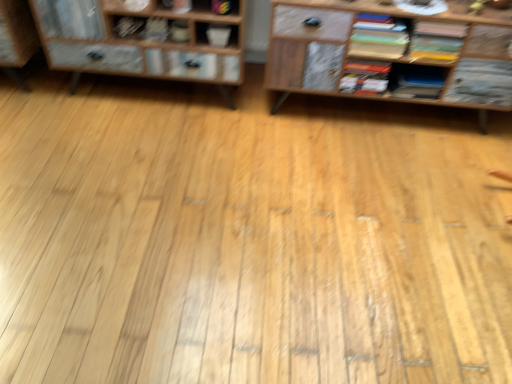
What is the approximate height of matte black book at center right, arranged as the 2th book when viewed from the right?

3.77 inches.

Identify the location of wooden cabinet at left. This screenshot has width=512, height=384. (143, 41).

You are a GUI agent. You are given a task and a screenshot of the screen. Output one action in this format:
    pyautogui.click(x=<x>, y=<y>)
    Task: Click on the multicolored paper stack at upper right, the 4th book from the left
    The height and width of the screenshot is (384, 512).
    Given the screenshot: What is the action you would take?
    pyautogui.click(x=378, y=36)

The width and height of the screenshot is (512, 384). What do you see at coordinates (129, 26) in the screenshot? I see `matte black book at upper left, which appears as the sixth book when viewed from the right` at bounding box center [129, 26].

What is the approximate height of matte yellow book at upper right, the 1th book from the right?

matte yellow book at upper right, the 1th book from the right, is 7.31 inches in height.

What are the coordinates of `matte black book at center right, arranged as the 2th book when viewed from the right` in the screenshot? It's located at (416, 81).

Considering the sizes of matte black book at center right, arranged as the 2th book when viewed from the right, and multicolored paper stack at upper right, the 4th book from the left, in the image, is matte black book at center right, arranged as the 2th book when viewed from the right, wider or thinner than multicolored paper stack at upper right, the 4th book from the left,?

In the image, matte black book at center right, arranged as the 2th book when viewed from the right, appears to be wider than multicolored paper stack at upper right, the 4th book from the left.

From a real-world perspective, is matte black book at center right, arranged as the 2th book when viewed from the right, positioned under multicolored paper stack at upper right, the 3th book from the right, based on gravity?

Yes, from a real-world perspective, matte black book at center right, arranged as the 2th book when viewed from the right, is beneath multicolored paper stack at upper right, the 3th book from the right.

How different are the orientations of matte black book at center right, arranged as the 2th book when viewed from the right, and multicolored paper stack at upper right, the 3th book from the right, in degrees?

0.000944 degrees.

Is point (412, 80) positioned in front of point (351, 52)?

No, it is behind (351, 52).

Is hardcover book at center, the 4th book in the right-to-left sequence, outside of matte black book at upper left, which appears as the sixth book when viewed from the right?

Indeed, hardcover book at center, the 4th book in the right-to-left sequence, is completely outside matte black book at upper left, which appears as the sixth book when viewed from the right.

Can you tell me how much hardcover book at center, the 4th book in the right-to-left sequence, and matte black book at upper left, placed as the first book when sorted from left to right, differ in facing direction?

hardcover book at center, the 4th book in the right-to-left sequence, and matte black book at upper left, placed as the first book when sorted from left to right, are facing 5.31 degrees away from each other.

Considering the points (374, 77) and (134, 20), which point is behind, point (374, 77) or point (134, 20)?

The point (134, 20) is farther.

From a real-world perspective, is hardcover book at center, which ranks as the 3th book in left-to-right order, on matte black book at upper left, placed as the first book when sorted from left to right?

Incorrect, from a real-world perspective, hardcover book at center, which ranks as the 3th book in left-to-right order, is lower than matte black book at upper left, placed as the first book when sorted from left to right.

Which is more to the left, matte gray book at upper center, marked as the 2th book in a left-to-right arrangement, or multicolored paper stack at upper right, the 4th book from the left?

Positioned to the left is matte gray book at upper center, marked as the 2th book in a left-to-right arrangement.

Who is shorter, matte gray book at upper center, marked as the 5th book in a right-to-left arrangement, or multicolored paper stack at upper right, the 3th book from the right?

matte gray book at upper center, marked as the 5th book in a right-to-left arrangement, is shorter.

Is multicolored paper stack at upper right, the 3th book from the right, at the back of matte gray book at upper center, marked as the 5th book in a right-to-left arrangement?

No, multicolored paper stack at upper right, the 3th book from the right, is not at the back of matte gray book at upper center, marked as the 5th book in a right-to-left arrangement.

Which book is the 2nd one when counting from the left side of the multicolored paper stack at upper right, the 4th book from the left? Please provide its 2D coordinates.

[(156, 29)]

From the image's perspective, between wooden cabinet at left and matte gray book at upper center, marked as the 5th book in a right-to-left arrangement, who is located below?

matte gray book at upper center, marked as the 5th book in a right-to-left arrangement, appears lower in the image.

Is wooden cabinet at left wider or thinner than matte gray book at upper center, marked as the 5th book in a right-to-left arrangement?

Clearly, wooden cabinet at left has more width compared to matte gray book at upper center, marked as the 5th book in a right-to-left arrangement.

Is wooden cabinet at left next to matte gray book at upper center, marked as the 5th book in a right-to-left arrangement?

No, wooden cabinet at left is not touching matte gray book at upper center, marked as the 5th book in a right-to-left arrangement.

From a real-world perspective, is wooden cabinet at left located beneath matte gray book at upper center, marked as the 5th book in a right-to-left arrangement?

Indeed, from a real-world perspective, wooden cabinet at left is positioned beneath matte gray book at upper center, marked as the 5th book in a right-to-left arrangement.

Based on their sizes in the image, would you say multicolored paper stack at upper right, the 4th book from the left, is bigger or smaller than hardcover book at center, which ranks as the 3th book in left-to-right order?

multicolored paper stack at upper right, the 4th book from the left, is bigger than hardcover book at center, which ranks as the 3th book in left-to-right order.

Is multicolored paper stack at upper right, the 4th book from the left, to the left or to the right of hardcover book at center, the 4th book in the right-to-left sequence, in the image?

In the image, multicolored paper stack at upper right, the 4th book from the left, appears on the right side of hardcover book at center, the 4th book in the right-to-left sequence.

From the image's perspective, would you say multicolored paper stack at upper right, the 3th book from the right, is positioned over hardcover book at center, the 4th book in the right-to-left sequence?

Yes, from the image's perspective, multicolored paper stack at upper right, the 3th book from the right, is above hardcover book at center, the 4th book in the right-to-left sequence.

From the picture: Which is closer to the camera, [366,88] or [142,33]?

The point [142,33] is in front.

From the image's perspective, between hardcover book at center, which ranks as the 3th book in left-to-right order, and matte gray book at upper center, marked as the 5th book in a right-to-left arrangement, who is located below?

From the image's view, hardcover book at center, which ranks as the 3th book in left-to-right order, is below.

From the image's perspective, is matte black book at center right, which is the 5th book from left to right, below hardcover book at center, the 4th book in the right-to-left sequence?

Yes, from the image's perspective, matte black book at center right, which is the 5th book from left to right, is below hardcover book at center, the 4th book in the right-to-left sequence.

Is matte black book at center right, arranged as the 2th book when viewed from the right, in front of hardcover book at center, which ranks as the 3th book in left-to-right order?

No, it is behind hardcover book at center, which ranks as the 3th book in left-to-right order.

Considering the sizes of matte black book at center right, which is the 5th book from left to right, and hardcover book at center, the 4th book in the right-to-left sequence, in the image, is matte black book at center right, which is the 5th book from left to right, wider or thinner than hardcover book at center, the 4th book in the right-to-left sequence,?

Considering their sizes, matte black book at center right, which is the 5th book from left to right, looks broader than hardcover book at center, the 4th book in the right-to-left sequence.

From a real-world perspective, is matte black book at center right, arranged as the 2th book when viewed from the right, above or below hardcover book at center, the 4th book in the right-to-left sequence?

From a real-world perspective, matte black book at center right, arranged as the 2th book when viewed from the right, is physically below hardcover book at center, the 4th book in the right-to-left sequence.

The height and width of the screenshot is (384, 512). In order to click on the 3rd book below the multicolored paper stack at upper right, the 4th book from the left (from the image's perspective) in this screenshot , I will do `click(416, 81)`.

From the matte black book at upper left, which appears as the sixth book when viewed from the right, count 1st books forward and point to it. Please provide its 2D coordinates.

[(365, 77)]

Based on their spatial positions, is matte black book at center right, arranged as the 2th book when viewed from the right, or hardcover book at center, which ranks as the 3th book in left-to-right order, further from multicolored paper stack at upper right, the 3th book from the right?

The object further to multicolored paper stack at upper right, the 3th book from the right, is matte black book at center right, arranged as the 2th book when viewed from the right.

From the image, which object appears to be farther from matte yellow book at upper right, the 1th book from the right, matte black book at center right, which is the 5th book from left to right, or matte black book at upper left, which appears as the sixth book when viewed from the right?

Based on the image, matte black book at upper left, which appears as the sixth book when viewed from the right, appears to be further to matte yellow book at upper right, the 1th book from the right.

When comparing their distances from matte black book at center right, arranged as the 2th book when viewed from the right, does matte gray book at upper center, marked as the 2th book in a left-to-right arrangement, or matte black book at upper left, which appears as the sixth book when viewed from the right, seem further?

matte black book at upper left, which appears as the sixth book when viewed from the right.

Looking at this image, when comparing their distances from wooden cabinet at left, does matte black book at upper left, placed as the first book when sorted from left to right, or matte gray book at upper center, marked as the 5th book in a right-to-left arrangement, seem further?

Based on the image, matte gray book at upper center, marked as the 5th book in a right-to-left arrangement, appears to be further to wooden cabinet at left.

Estimate the real-world distances between objects in this image. Which object is further from wooden cabinet at left, matte black book at center right, arranged as the 2th book when viewed from the right, or matte yellow book at upper right, the 1th book from the right?

Based on the image, matte yellow book at upper right, the 1th book from the right, appears to be further to wooden cabinet at left.

Considering their positions, is hardcover book at center, which ranks as the 3th book in left-to-right order, positioned further to wooden cabinet at left than multicolored paper stack at upper right, the 3th book from the right?

The object further to wooden cabinet at left is hardcover book at center, which ranks as the 3th book in left-to-right order.

Considering their positions, is hardcover book at center, which ranks as the 3th book in left-to-right order, positioned further to matte black book at upper left, placed as the first book when sorted from left to right, than multicolored paper stack at upper right, the 4th book from the left?

Among the two, multicolored paper stack at upper right, the 4th book from the left, is located further to matte black book at upper left, placed as the first book when sorted from left to right.

Which object lies further to the anchor point hardcover book at center, the 4th book in the right-to-left sequence, multicolored paper stack at upper right, the 4th book from the left, or wooden cabinet at left?

Based on the image, wooden cabinet at left appears to be further to hardcover book at center, the 4th book in the right-to-left sequence.

Find the location of a particular element. Image resolution: width=512 pixels, height=384 pixels. book situated between hardcover book at center, which ranks as the 3th book in left-to-right order, and matte black book at center right, which is the 5th book from left to right, from left to right is located at coordinates (378, 36).

At what (x,y) coordinates should I click in order to perform the action: click on book located between multicolored paper stack at upper right, the 3th book from the right, and matte yellow book at upper right, the 1th book from the right, in the left-right direction. Please return your answer as a coordinate pair (x, y). Looking at the image, I should click on (416, 81).

The width and height of the screenshot is (512, 384). In order to click on shelf between matte black book at upper left, which appears as the sixth book when viewed from the right, and hardcover book at center, the 4th book in the right-to-left sequence in this screenshot , I will do coord(143,41).

I want to click on shelf between matte black book at upper left, placed as the first book when sorted from left to right, and matte yellow book at upper right, marked as the sixth book in a left-to-right arrangement, from left to right, so click(143, 41).